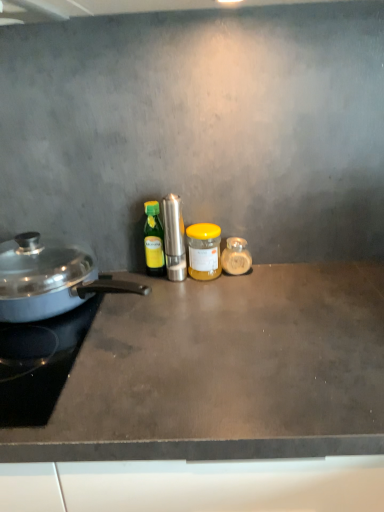
You are a GUI agent. You are given a task and a screenshot of the screen. Output one action in this format:
    pyautogui.click(x=<x>, y=<y>)
    Task: Click on the free space that is in between shiny silver pan at left, acting as the fifth kitchen appliance starting from the right, and translucent glass jar at center, the first kitchen appliance when ordered from right to left
    The image size is (384, 512).
    Given the screenshot: What is the action you would take?
    pyautogui.click(x=196, y=303)